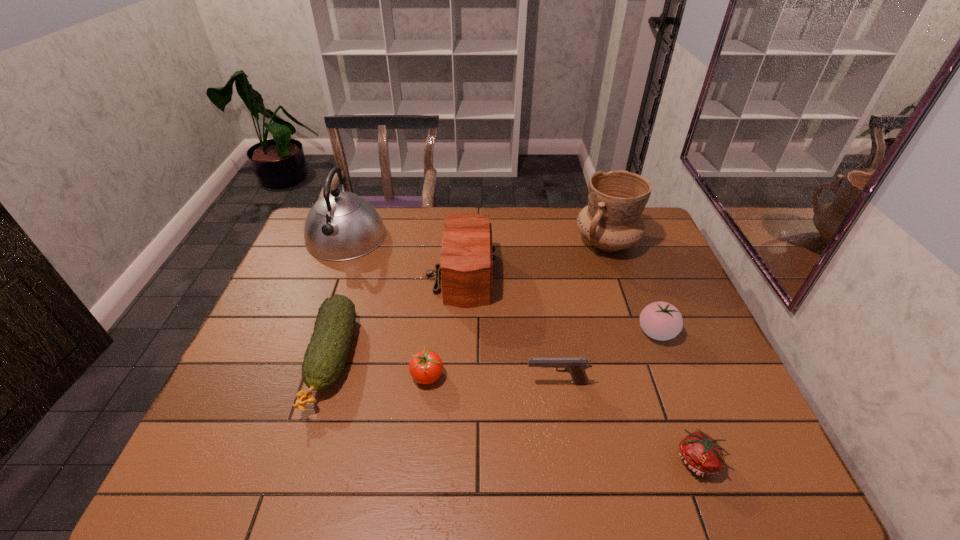
At what (x,y) coordinates should I click in order to perform the action: click on vacant area that lies between the third tallest object and the cucumber. Please return your answer as a coordinate pair (x, y). Looking at the image, I should click on (396, 318).

The image size is (960, 540). Find the location of `vacant space that's between the pottery and the third tallest object`. vacant space that's between the pottery and the third tallest object is located at coordinates (533, 259).

Find the location of a particular element. The image size is (960, 540). free space between the pottery and the nearest object is located at coordinates [653, 352].

Identify the location of free spot between the second nearest tomato and the pottery. The image size is (960, 540). (516, 309).

This screenshot has height=540, width=960. I want to click on free spot between the third tallest object and the fifth object from left to right, so click(508, 329).

You are a GUI agent. You are given a task and a screenshot of the screen. Output one action in this format:
    pyautogui.click(x=<x>, y=<y>)
    Task: Click on the empty space that is in between the nearest object and the tallest tomato
    Image resolution: width=960 pixels, height=540 pixels.
    Given the screenshot: What is the action you would take?
    pyautogui.click(x=678, y=396)

Locate an element on the screen. The width and height of the screenshot is (960, 540). free space between the fourth object from right to left and the cucumber is located at coordinates (444, 371).

The width and height of the screenshot is (960, 540). Identify the location of vacant region between the second nearest tomato and the nearest tomato. (563, 418).

Locate an element on the screen. This screenshot has width=960, height=540. free space between the tallest tomato and the nearest object is located at coordinates (678, 396).

I want to click on the seventh closest object to the cucumber, so click(x=660, y=320).